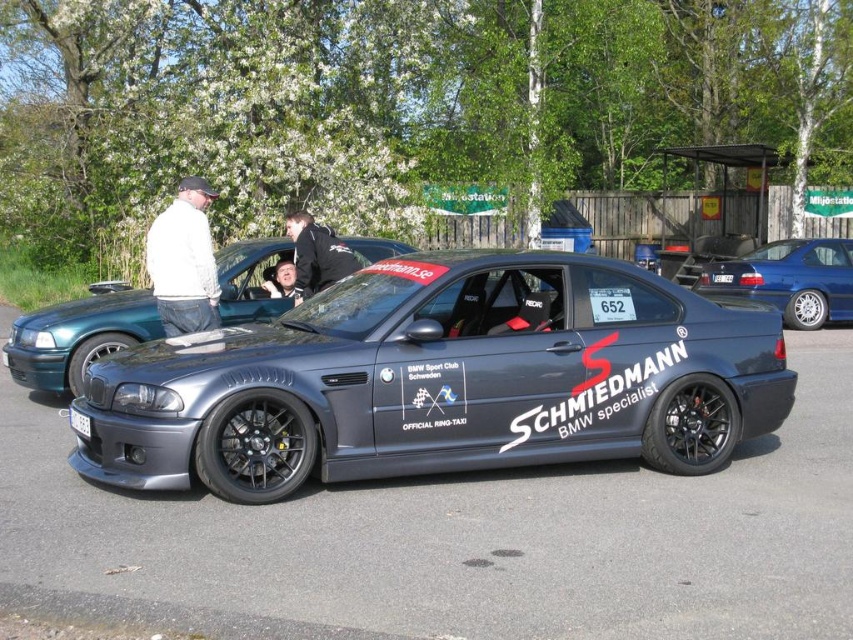
Can you confirm if metallic gray sports car at center is shorter than metallic blue car at center?

No.

Based on the photo, who is positioned more to the left, metallic gray sports car at center or metallic blue car at center?

metallic gray sports car at center

Between point (235, 499) and point (746, 275), which one is positioned in front?

Point (235, 499) is in front.

This screenshot has width=853, height=640. Find the location of `metallic gray sports car at center`. metallic gray sports car at center is located at coordinates (440, 380).

Image resolution: width=853 pixels, height=640 pixels. Describe the element at coordinates (184, 260) in the screenshot. I see `white cotton jacket at upper left` at that location.

Which is behind, point (184, 312) or point (663, 250)?

The point (663, 250) is behind.

Find the location of a particular element. Image resolution: width=853 pixels, height=640 pixels. white cotton jacket at upper left is located at coordinates (184, 260).

What do you see at coordinates (791, 280) in the screenshot? I see `metallic blue car at center` at bounding box center [791, 280].

Between metallic blue car at center and black leather jacket at center, which one appears on the right side from the viewer's perspective?

From the viewer's perspective, metallic blue car at center appears more on the right side.

Where is `metallic blue car at center`? This screenshot has width=853, height=640. metallic blue car at center is located at coordinates (791, 280).